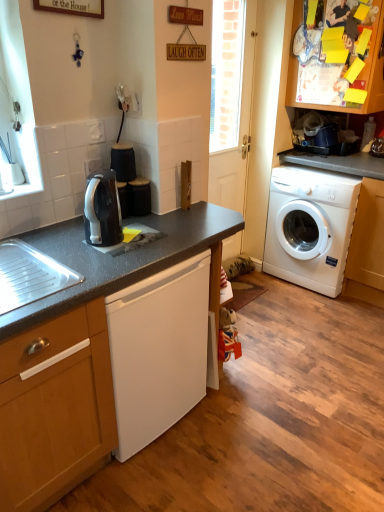
Question: Considering the positions of point (97, 226) and point (14, 476), is point (97, 226) closer or farther from the camera than point (14, 476)?

Choices:
 (A) closer
 (B) farther

Answer: (B)

Question: Is black glossy kettle at upper left wider or thinner than wooden cabinet at lower left, which is the first cabinetry from bottom to top?

Choices:
 (A) thin
 (B) wide

Answer: (A)

Question: Which of these objects is positioned farthest from the wooden cabinet at lower left, marked as the 2th cabinetry in a back-to-front arrangement?

Choices:
 (A) black granite countertop at center
 (B) white glossy door at center
 (C) white plastic washing machine at right
 (D) black glossy kettle at upper left
 (E) yellow paper at upper right, positioned as the 1th cabinetry in right-to-left order

Answer: (E)

Question: Which of these objects is positioned closest to the white plastic washing machine at right?

Choices:
 (A) white glossy door at center
 (B) yellow paper at upper right, arranged as the second cabinetry when viewed from the front
 (C) wooden cabinet at lower left, which is the first cabinetry from bottom to top
 (D) black glossy kettle at upper left
 (E) black granite countertop at center

Answer: (A)